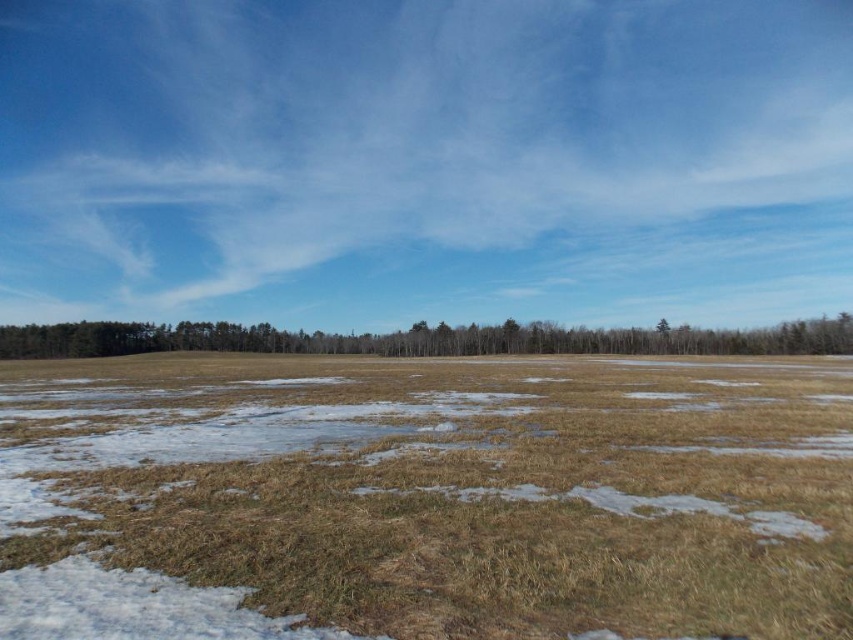
You are a hiker trying to cross the open field. You see the brown dry grass at center and the brown matte trees at center. Which object is closer to you?

The brown dry grass at center is positioned under the brown matte trees at center, meaning it is closer to you.

From the picture: You are a hiker trying to cross the field. You see the brown dry grass at center and the brown matte trees at center. Which one is closer to you?

The brown dry grass at center is closer because it is in front of the brown matte trees at center.

Consider the image. You are a hiker trying to cross the field from the left edge to the right edge. You need to avoid the brown matte trees at center. Which direction should you walk relative to the brown dry grass at center to stay clear of the trees?

To avoid the brown matte trees at center, you should walk to the left of the brown dry grass at center since the brown dry grass at center is already positioned to the right of the trees, meaning moving left from there would keep you away from the trees.